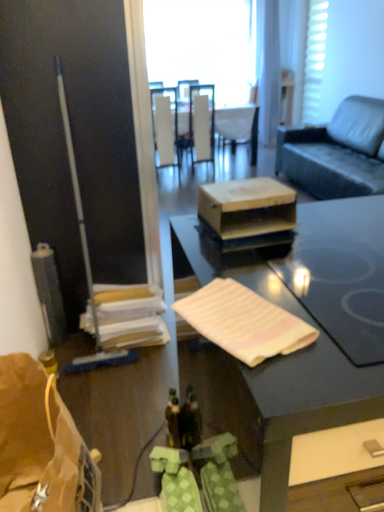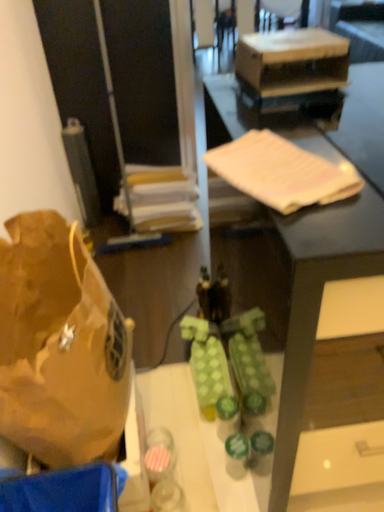
Question: Which way did the camera rotate in the video?

Choices:
 (A) rotated downward
 (B) rotated upward

Answer: (A)